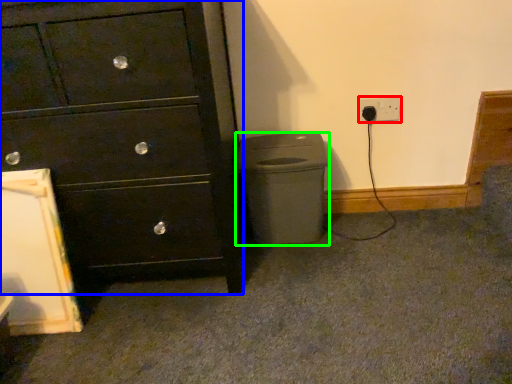
Question: Considering the real-world distances, which object is farthest from power plugs and sockets (highlighted by a red box)? chest of drawers (highlighted by a blue box) or waste container (highlighted by a green box)?

Choices:
 (A) chest of drawers
 (B) waste container

Answer: (A)